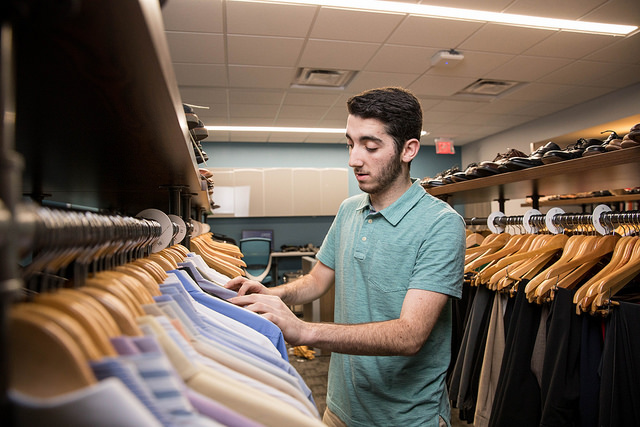
Locate an element on the screen. This screenshot has height=427, width=640. carpet is located at coordinates (316, 384).